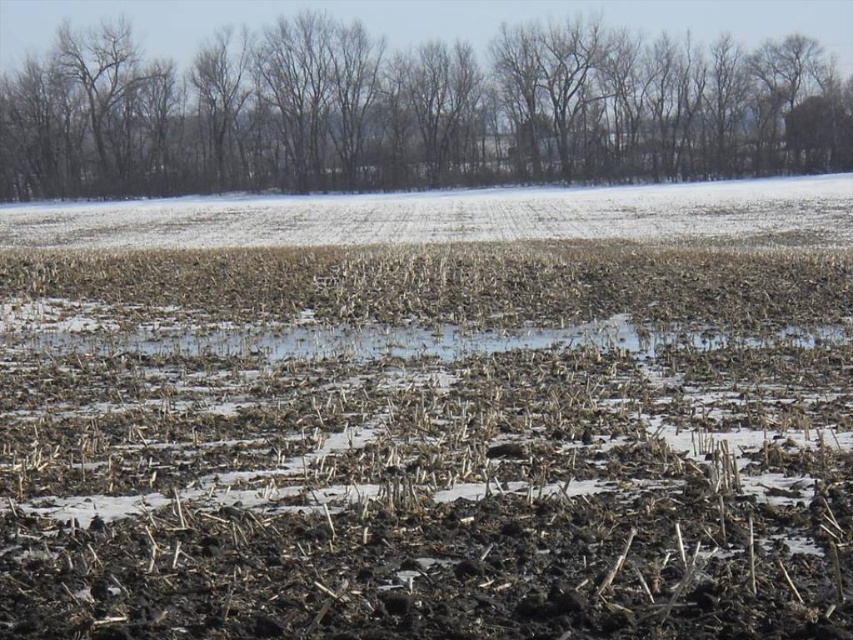
You are a farmer planning to plant seeds in the brown soil at center. Based on the scene, what is the condition of the soil in terms of moisture and readiness for planting?

The brown soil at center is ready for planting as it has been freshly plowed and shows scattered crop stalks, indicating recent harvesting. The presence of partial snowmelt suggests adequate moisture from melting snow, making it suitable for planting.

You are standing in the rural landscape and want to walk from the point at coordinates point (x=514, y=500) to the point at coordinates point (x=140, y=168). Considering the plowed field and snow patches, which direction should you walk to move towards the second point?

You should walk towards the direction of point (x=140, y=168), which is behind point (x=514, y=500). Since point (x=514, y=500) is in front of point (x=140, y=168), you need to move backward or in the opposite direction of the foreground to reach the second point.